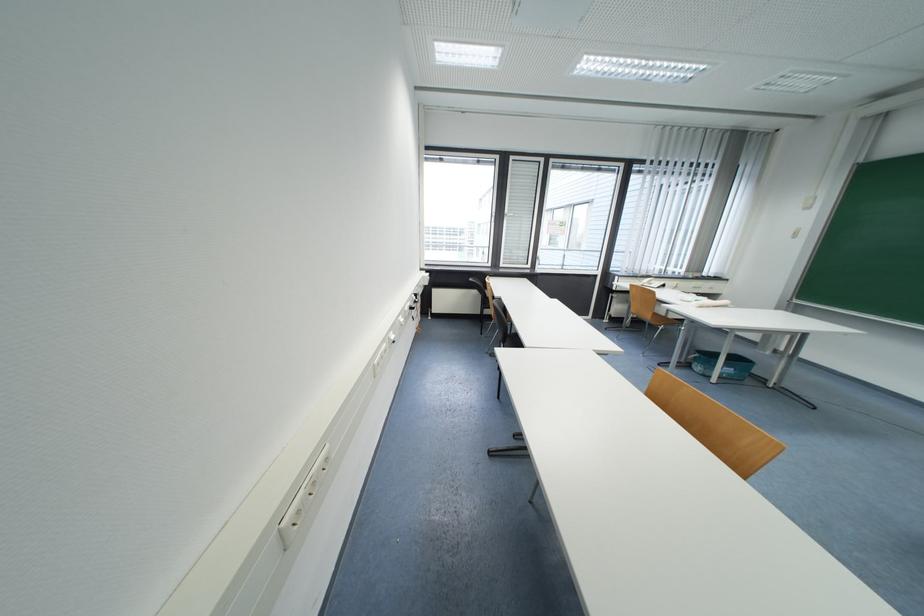
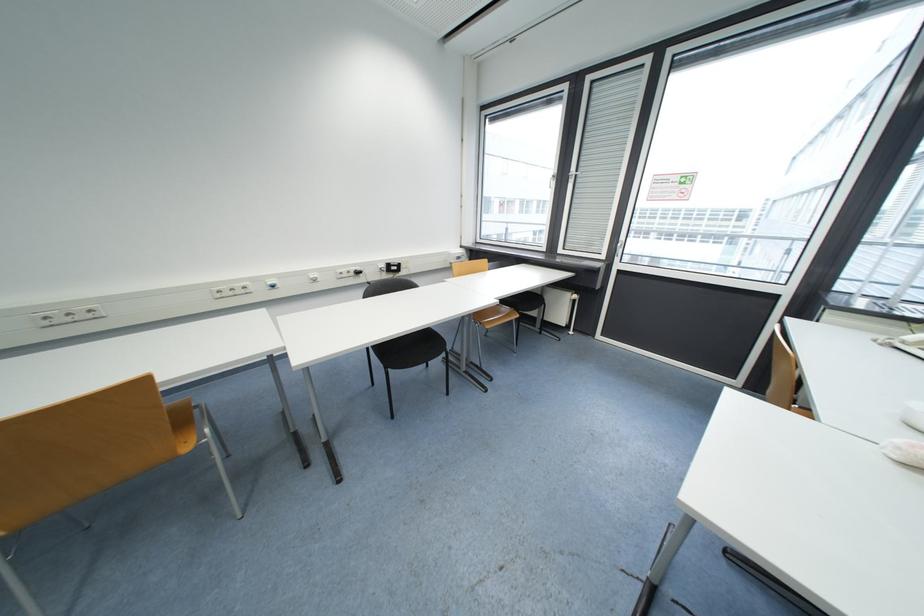
Locate, in the second image, the point that corresponds to point 397,339 in the first image.

(274, 285)